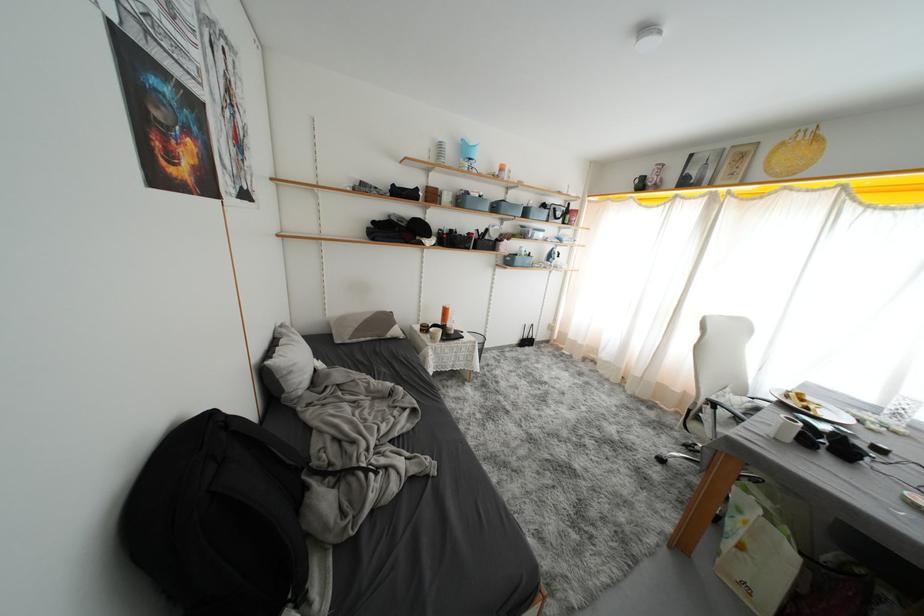
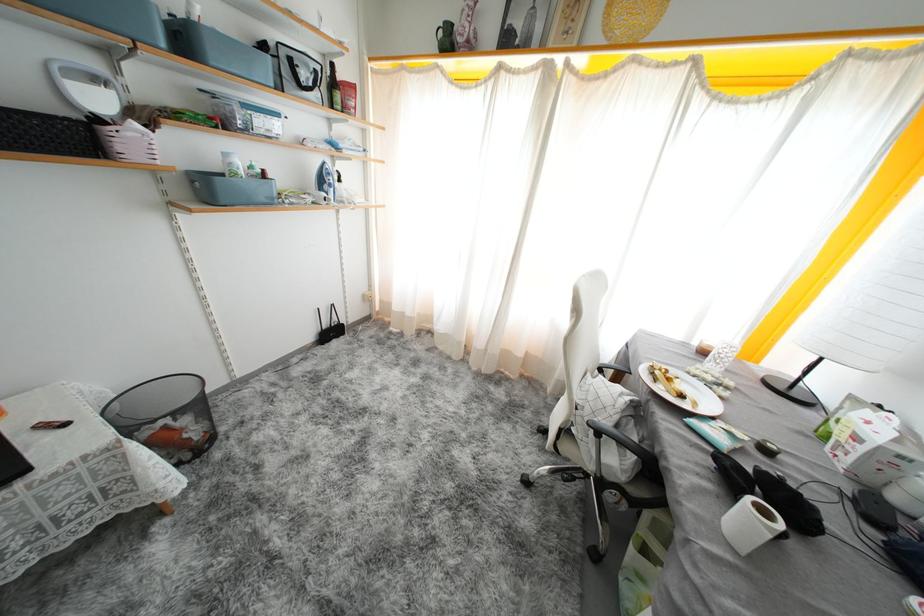
Locate, in the second image, the point that corresponds to (642,185) in the first image.

(446, 37)